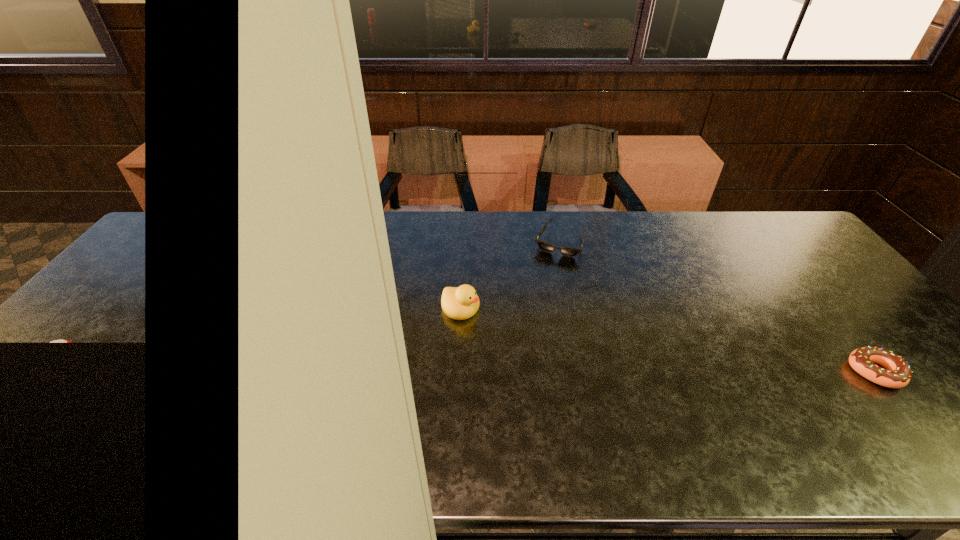
Find the location of a particular element. vacant space at the right edge is located at coordinates (817, 300).

Where is `vacant region at the near left corner of the desktop`? This screenshot has height=540, width=960. vacant region at the near left corner of the desktop is located at coordinates (58, 417).

Where is `blank space at the far right corner of the desktop`? Image resolution: width=960 pixels, height=540 pixels. blank space at the far right corner of the desktop is located at coordinates (776, 228).

This screenshot has height=540, width=960. What are the coordinates of `free space that is in between the doughnut and the sunglasses` in the screenshot? It's located at (717, 308).

Where is `unoccupied area between the tallest object and the second object from left to right`? unoccupied area between the tallest object and the second object from left to right is located at coordinates (510, 275).

What are the coordinates of `free space between the sunglasses and the leftmost object` in the screenshot? It's located at (x=510, y=275).

Find the location of `free space between the rightmost object and the second object from right to left`. free space between the rightmost object and the second object from right to left is located at coordinates pyautogui.click(x=717, y=308).

Point out which object is positioned as the second nearest to the doughnut. Please provide its 2D coordinates. Your answer should be formatted as a tuple, i.e. [(x, y)], where the tuple contains the x and y coordinates of a point satisfying the conditions above.

[(459, 303)]

Identify which object is the second closest to the farthest object. Please provide its 2D coordinates. Your answer should be formatted as a tuple, i.e. [(x, y)], where the tuple contains the x and y coordinates of a point satisfying the conditions above.

[(897, 373)]